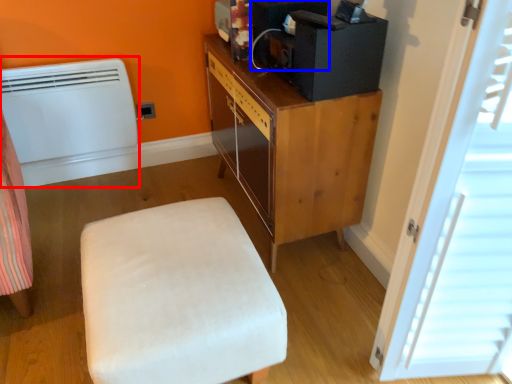
Question: Which point is further to the camera, heater (highlighted by a red box) or appliance (highlighted by a blue box)?

Choices:
 (A) heater
 (B) appliance

Answer: (A)